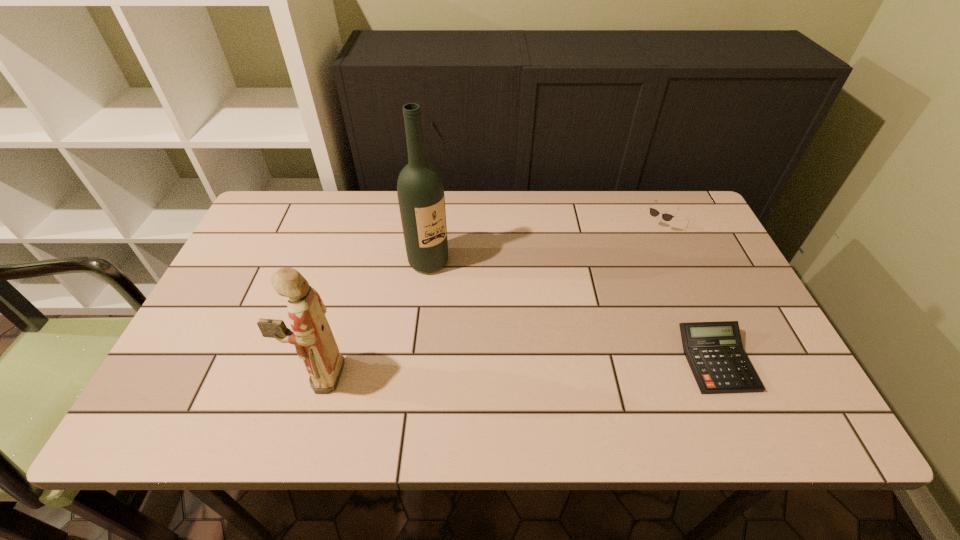
Find the location of `figurine`. figurine is located at coordinates (312, 336).

Locate an element on the screen. Image resolution: width=960 pixels, height=540 pixels. the leftmost object is located at coordinates (312, 336).

Find the location of `the shortest object`. the shortest object is located at coordinates (714, 351).

The image size is (960, 540). I want to click on the third nearest object, so click(x=420, y=190).

Identify the location of the second object from left to right. (420, 190).

Where is `the farthest object`? The height and width of the screenshot is (540, 960). the farthest object is located at coordinates (666, 217).

Where is `sunglasses`? The width and height of the screenshot is (960, 540). sunglasses is located at coordinates (666, 217).

Locate an element on the screen. This screenshot has height=540, width=960. free space located on the front-facing side of the figurine is located at coordinates (256, 375).

Identify the location of vacant space situated on the front-facing side of the figurine. This screenshot has height=540, width=960. (220, 375).

Identify the location of free space located 0.060m on the front-facing side of the figurine. The width and height of the screenshot is (960, 540). (270, 375).